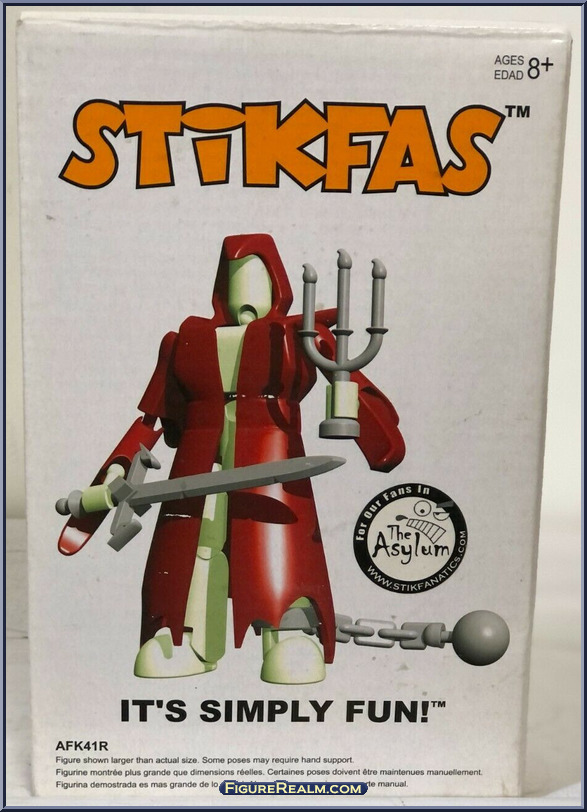
Identify the location of corner. (559, 37).